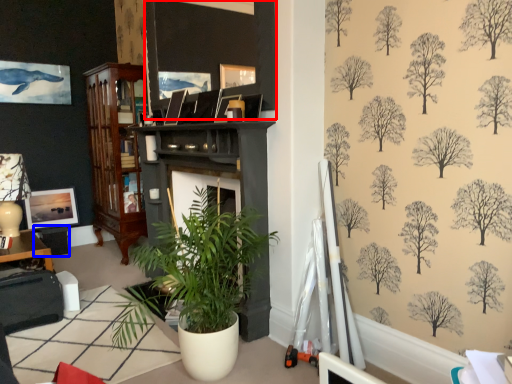
Question: Which of the following is the closest to the observer, picture frame (highlighted by a red box) or table (highlighted by a blue box)?

Choices:
 (A) picture frame
 (B) table

Answer: (A)